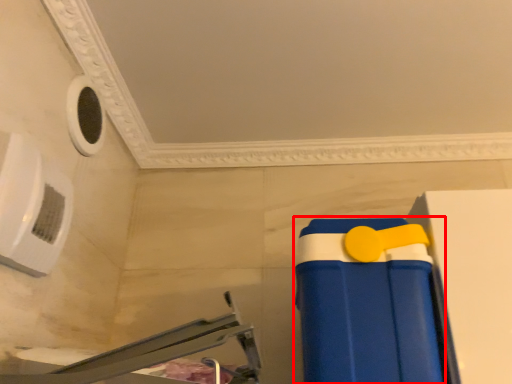
Question: From the image's perspective, what is the correct spatial relationship of toy (annotated by the red box) in relation to furniture?

Choices:
 (A) above
 (B) below

Answer: (B)